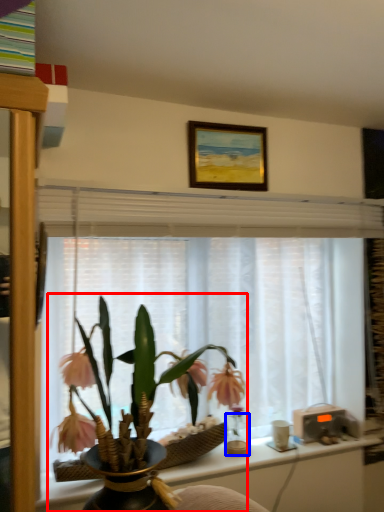
Question: Which object is further to the camera taking this photo, houseplant (highlighted by a red box) or glass vase (highlighted by a blue box)?

Choices:
 (A) houseplant
 (B) glass vase

Answer: (B)